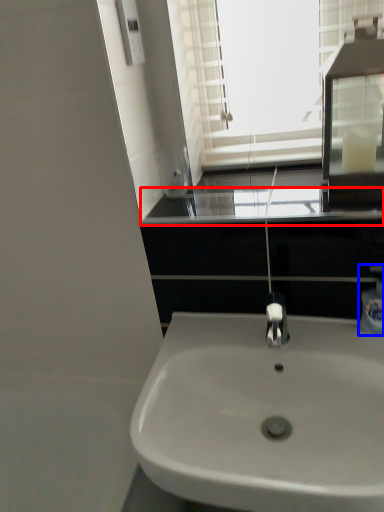
Question: Which object is further to the camera taking this photo, window sill (highlighted by a red box) or soap dispenser (highlighted by a blue box)?

Choices:
 (A) window sill
 (B) soap dispenser

Answer: (B)